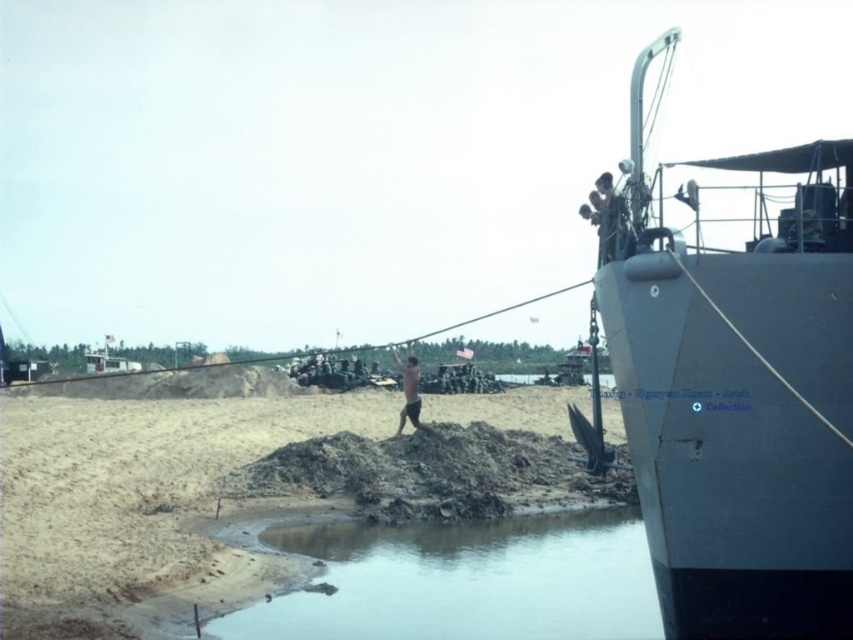
You are a lifeguard on duty at the beach. You notice two areas of concern near the shore. The brown sandy dirt at center and the muddy water at lower left. Which area has a larger surface area?

The brown sandy dirt at center has a larger surface area than the muddy water at lower left.

You are a photographer trying to capture the dark gray metal boat at upper right and the skinny man at center in the same frame. Based on their sizes, which object would appear larger in your photo?

The dark gray metal boat at upper right would appear larger in the photo because it is much taller than the skinny man at center.